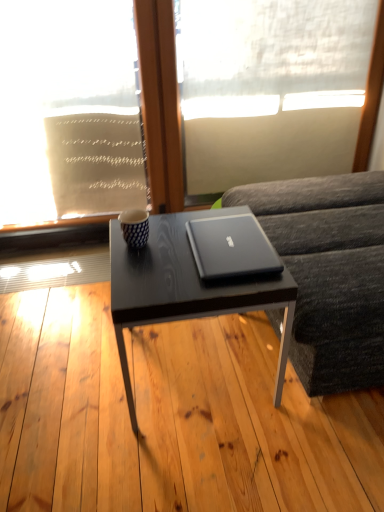
What is the approximate height of matte black table at center?

matte black table at center is 9.82 centimeters in height.

At what (x,y) coordinates should I click in order to perform the action: click on dark gray fabric couch at right. Please return your answer as a coordinate pair (x, y). Looking at the image, I should click on (329, 273).

In order to face white sheer fabric at upper center, marked as the 2th window screen in a left-to-right arrangement, should I rotate leftwards or rightwards?

Rotate right and turn 10.850 degrees.

Image resolution: width=384 pixels, height=512 pixels. What do you see at coordinates (185, 287) in the screenshot? I see `matte black coffee table at center` at bounding box center [185, 287].

Image resolution: width=384 pixels, height=512 pixels. What do you see at coordinates (135, 227) in the screenshot?
I see `blue and white textured mug at center` at bounding box center [135, 227].

In order to click on matte black table at center in this screenshot , I will do `click(170, 417)`.

From the picture: Considering the relative sizes of matte black coffee table at center and dark gray fabric couch at right in the image provided, is matte black coffee table at center smaller than dark gray fabric couch at right?

Yes.

From a real-world perspective, is matte black coffee table at center located beneath dark gray fabric couch at right?

Correct, in the physical world, matte black coffee table at center is lower than dark gray fabric couch at right.

From the image's perspective, between matte black coffee table at center and dark gray fabric couch at right, who is located below?

matte black coffee table at center.

Is white sheer fabric at upper center, marked as the 2th window screen in a left-to-right arrangement, located outside satin black laptop at center?

That's correct, white sheer fabric at upper center, marked as the 2th window screen in a left-to-right arrangement, is outside of satin black laptop at center.

From a real-world perspective, does white sheer fabric at upper center, marked as the 2th window screen in a left-to-right arrangement, stand above satin black laptop at center?

Correct, in the physical world, white sheer fabric at upper center, marked as the 2th window screen in a left-to-right arrangement, is higher than satin black laptop at center.

Can you confirm if white sheer fabric at upper center, the first window screen from the right, is positioned to the right of satin black laptop at center?

Yes.

Is white sheer fabric at upper center, marked as the 2th window screen in a left-to-right arrangement, oriented away from satin black laptop at center?

white sheer fabric at upper center, marked as the 2th window screen in a left-to-right arrangement, does not have its back to satin black laptop at center.

Between dark gray fabric couch at right and blue and white textured mug at center, which one has smaller width?

blue and white textured mug at center is thinner.

Considering the relative sizes of dark gray fabric couch at right and blue and white textured mug at center in the image provided, is dark gray fabric couch at right taller than blue and white textured mug at center?

Indeed, dark gray fabric couch at right has a greater height compared to blue and white textured mug at center.

Is dark gray fabric couch at right further to the viewer compared to blue and white textured mug at center?

No, dark gray fabric couch at right is closer to the camera.

Is dark gray fabric couch at right far from blue and white textured mug at center?

dark gray fabric couch at right is near blue and white textured mug at center, not far away.

Considering the relative positions of blue and white textured mug at center and white sheer fabric at upper left, the 2th window screen in the right-to-left sequence, in the image provided, is blue and white textured mug at center behind white sheer fabric at upper left, the 2th window screen in the right-to-left sequence,?

No, it is in front of white sheer fabric at upper left, the 2th window screen in the right-to-left sequence.

Which point is more forward, (127,213) or (108,51)?

The point (108,51) is in front.

Which of these two, blue and white textured mug at center or white sheer fabric at upper left, acting as the 1th window screen starting from the left, stands taller?

With more height is white sheer fabric at upper left, acting as the 1th window screen starting from the left.

Based on their sizes in the image, would you say blue and white textured mug at center is bigger or smaller than white sheer fabric at upper left, the 2th window screen in the right-to-left sequence?

In the image, blue and white textured mug at center appears to be smaller than white sheer fabric at upper left, the 2th window screen in the right-to-left sequence.

From the image's perspective, is dark gray fabric couch at right on white sheer fabric at upper center, the first window screen from the right?

Actually, dark gray fabric couch at right appears below white sheer fabric at upper center, the first window screen from the right, in the image.

Is dark gray fabric couch at right not inside white sheer fabric at upper center, marked as the 2th window screen in a left-to-right arrangement?

Yes, dark gray fabric couch at right is located beyond the bounds of white sheer fabric at upper center, marked as the 2th window screen in a left-to-right arrangement.

Considering the positions of objects dark gray fabric couch at right and white sheer fabric at upper center, the first window screen from the right, in the image provided, who is in front, dark gray fabric couch at right or white sheer fabric at upper center, the first window screen from the right,?

dark gray fabric couch at right is closer to the camera.

Between dark gray fabric couch at right and white sheer fabric at upper center, the first window screen from the right, which one appears on the right side from the viewer's perspective?

dark gray fabric couch at right is more to the right.

Which is in front, matte black table at center or blue and white textured mug at center?

matte black table at center is closer to the camera.

Looking at this image, would you say matte black table at center is to the left or to the right of blue and white textured mug at center in the picture?

Based on their positions, matte black table at center is located to the right of blue and white textured mug at center.

At what (x,y) coordinates should I click in order to perform the action: click on hardwood that is under the blue and white textured mug at center (from a real-world perspective). Please return your answer as a coordinate pair (x, y). This screenshot has height=512, width=384. Looking at the image, I should click on (170, 417).

Is matte black table at center positioned with its back to blue and white textured mug at center?

That's not correct — matte black table at center is not looking away from blue and white textured mug at center.

From a real-world perspective, is white sheer fabric at upper left, acting as the 1th window screen starting from the left, beneath satin black laptop at center?

Incorrect, from a real-world perspective, white sheer fabric at upper left, acting as the 1th window screen starting from the left, is higher than satin black laptop at center.

What's the angular difference between white sheer fabric at upper left, acting as the 1th window screen starting from the left, and satin black laptop at center's facing directions?

0.866 degrees.

Between white sheer fabric at upper left, the 2th window screen in the right-to-left sequence, and satin black laptop at center, which one appears on the right side from the viewer's perspective?

Positioned to the right is satin black laptop at center.

Locate an element on the screen. window screen that appears on the left of satin black laptop at center is located at coordinates (68, 111).

In the image, there is a dark gray fabric couch at right. In order to click on coffee table below it (from the image's perspective) in this screenshot , I will do `click(185, 287)`.

Find the location of a particular element. laptop in front of the white sheer fabric at upper center, marked as the 2th window screen in a left-to-right arrangement is located at coordinates (231, 247).

Looking at the image, which one is located further to white sheer fabric at upper center, marked as the 2th window screen in a left-to-right arrangement, dark gray fabric couch at right or matte black table at center?

matte black table at center.

Considering their positions, is white sheer fabric at upper left, the 2th window screen in the right-to-left sequence, positioned further to matte black coffee table at center than white sheer fabric at upper center, the first window screen from the right?

Based on the image, white sheer fabric at upper center, the first window screen from the right, appears to be further to matte black coffee table at center.

Looking at the image, which one is located closer to satin black laptop at center, matte black table at center or blue and white textured mug at center?

The object closer to satin black laptop at center is blue and white textured mug at center.

Consider the image. Which object lies further to the anchor point matte black coffee table at center, white sheer fabric at upper center, the first window screen from the right, or dark gray fabric couch at right?

Based on the image, white sheer fabric at upper center, the first window screen from the right, appears to be further to matte black coffee table at center.

Estimate the real-world distances between objects in this image. Which object is further from white sheer fabric at upper center, the first window screen from the right, matte black table at center or white sheer fabric at upper left, the 2th window screen in the right-to-left sequence?

matte black table at center is positioned further to the anchor white sheer fabric at upper center, the first window screen from the right.

Considering their positions, is white sheer fabric at upper center, marked as the 2th window screen in a left-to-right arrangement, positioned closer to dark gray fabric couch at right than blue and white textured mug at center?

blue and white textured mug at center is positioned closer to the anchor dark gray fabric couch at right.

When comparing their distances from satin black laptop at center, does matte black coffee table at center or blue and white textured mug at center seem further?

Based on the image, blue and white textured mug at center appears to be further to satin black laptop at center.

Which object lies nearer to the anchor point blue and white textured mug at center, matte black coffee table at center or matte black table at center?

Based on the image, matte black coffee table at center appears to be nearer to blue and white textured mug at center.

I want to click on coffee cup between white sheer fabric at upper left, acting as the 1th window screen starting from the left, and white sheer fabric at upper center, the first window screen from the right, from left to right, so click(135, 227).

Image resolution: width=384 pixels, height=512 pixels. In order to click on laptop between white sheer fabric at upper center, marked as the 2th window screen in a left-to-right arrangement, and matte black coffee table at center, in the vertical direction in this screenshot , I will do `click(231, 247)`.

Identify the location of coffee table between blue and white textured mug at center and satin black laptop at center in the horizontal direction. (185, 287).

The height and width of the screenshot is (512, 384). I want to click on laptop between matte black table at center and dark gray fabric couch at right in the horizontal direction, so click(x=231, y=247).